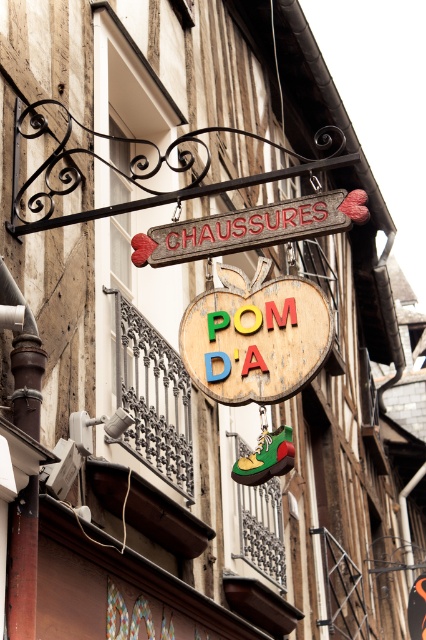
You are a window cleaner standing on a ladder. You need to clean both the wooden sign at center and the wooden signboard at center. The ladder can only reach up to 10 feet. Can you clean both without moving the ladder?

The wooden sign at center and wooden signboard at center are 10.59 feet apart from each other. Since the ladder can only reach up to 10 feet, you cannot clean both without moving the ladder because the distance between them exceeds the ladder reach.

You are a customer standing in front of the store. You see the wooden sign at center and the wooden signboard at center. Which one is positioned lower?

The wooden sign at center is positioned lower than the wooden signboard at center.